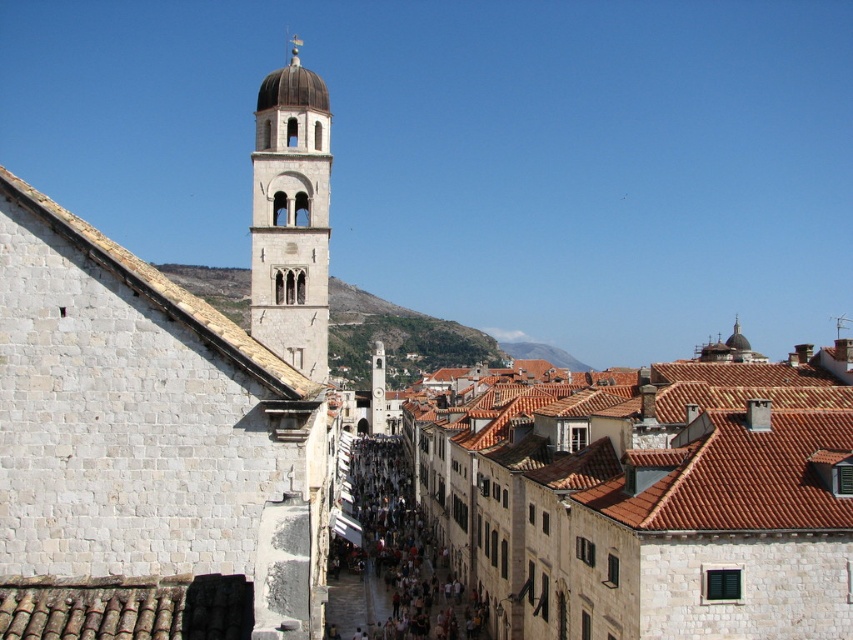
Does light beige stone bell tower at center have a lesser height compared to dark brown stone crowd at center?

No.

Is light beige stone bell tower at center bigger than dark brown stone crowd at center?

Actually, light beige stone bell tower at center might be smaller than dark brown stone crowd at center.

Is point (294, 51) in front of point (329, 620)?

No, it is behind (329, 620).

Identify the location of light beige stone bell tower at center. (291, 218).

Which is more to the left, white stone tower at upper left or light beige stone bell tower at center?

white stone tower at upper left is more to the left.

Is point (57, 257) in front of point (320, 196)?

Yes, point (57, 257) is in front of point (320, 196).

Identify the location of white stone tower at upper left. This screenshot has height=640, width=853. (169, 413).

Between brown tiled roofs at center and dark brown stone crowd at center, which one is positioned lower?

dark brown stone crowd at center

Does brown tiled roofs at center have a greater height compared to dark brown stone crowd at center?

Correct, brown tiled roofs at center is much taller as dark brown stone crowd at center.

Find the location of a particular element. Image resolution: width=853 pixels, height=640 pixels. brown tiled roofs at center is located at coordinates (654, 512).